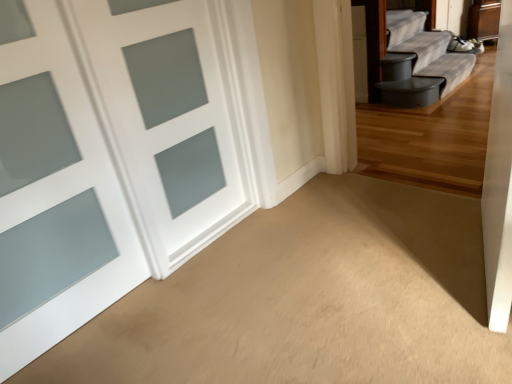
This screenshot has width=512, height=384. I want to click on vacant area that is in front of white frosted glass door at left, placed as the 1th door when sorted from right to left, so click(214, 272).